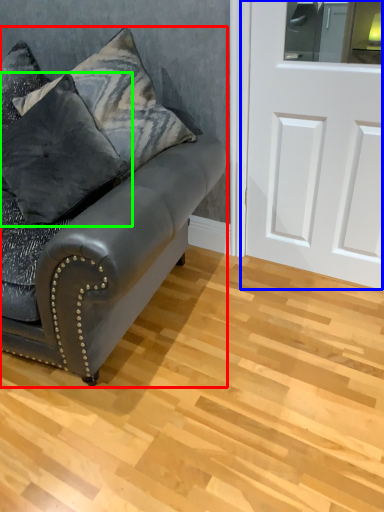
Question: Which object is the closest to the studio couch (highlighted by a red box)? Choose among these: door (highlighted by a blue box) or pillow (highlighted by a green box).

Choices:
 (A) door
 (B) pillow

Answer: (B)